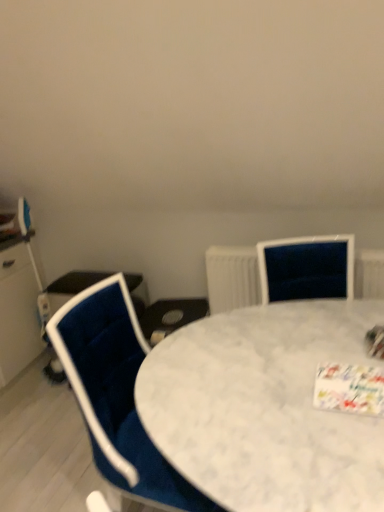
Question: Does white textured radiator at upper right turn towards white marble table at center?

Choices:
 (A) no
 (B) yes

Answer: (B)

Question: Considering the relative sizes of white textured radiator at upper right and white marble table at center in the image provided, is white textured radiator at upper right thinner than white marble table at center?

Choices:
 (A) no
 (B) yes

Answer: (B)

Question: Would you say white textured radiator at upper right is outside white marble table at center?

Choices:
 (A) no
 (B) yes

Answer: (B)

Question: Does white textured radiator at upper right appear on the left side of white marble table at center?

Choices:
 (A) yes
 (B) no

Answer: (B)

Question: Is white textured radiator at upper right further to camera compared to white marble table at center?

Choices:
 (A) no
 (B) yes

Answer: (B)

Question: Is the position of white textured radiator at upper right less distant than that of white marble table at center?

Choices:
 (A) yes
 (B) no

Answer: (B)

Question: From a real-world perspective, does white marble table at center stand above velvet blue chair at left?

Choices:
 (A) yes
 (B) no

Answer: (B)

Question: Does white marble table at center have a lesser height compared to velvet blue chair at left?

Choices:
 (A) no
 (B) yes

Answer: (B)

Question: Can you confirm if white marble table at center is bigger than velvet blue chair at left?

Choices:
 (A) yes
 (B) no

Answer: (A)

Question: Can you confirm if white marble table at center is smaller than velvet blue chair at left?

Choices:
 (A) no
 (B) yes

Answer: (A)

Question: Could velvet blue chair at left be considered to be inside white marble table at center?

Choices:
 (A) yes
 (B) no

Answer: (A)

Question: From a real-world perspective, does white marble table at center sit lower than velvet blue chair at left?

Choices:
 (A) yes
 (B) no

Answer: (A)

Question: Is velvet blue chair at left turned away from white marble table at center?

Choices:
 (A) no
 (B) yes

Answer: (B)